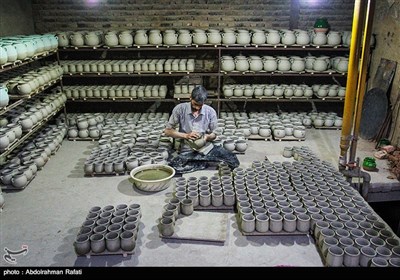
You are a GUI agent. You are given a task and a screenshot of the screen. Output one action in this format:
    pyautogui.click(x=<x>, y=<y>)
    Task: Click on the brick wall
    Image resolution: width=400 pixels, height=280 pixels.
    Given the screenshot: What is the action you would take?
    pyautogui.click(x=195, y=8)